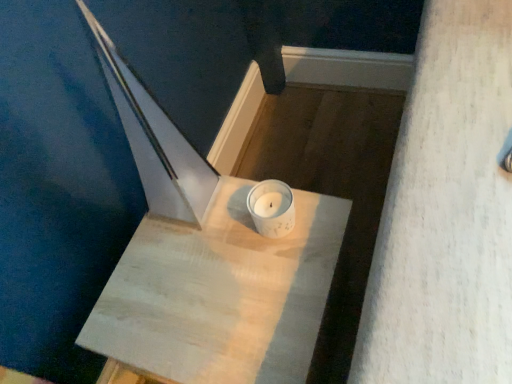
Measure the distance between white marble table at center and camera.

The distance of white marble table at center from camera is 25.28 inches.

What do you see at coordinates (221, 294) in the screenshot? I see `white marble table at center` at bounding box center [221, 294].

You are a GUI agent. You are given a task and a screenshot of the screen. Output one action in this format:
    pyautogui.click(x=<x>, y=<y>)
    Task: Click on the white marble table at center
    
    Given the screenshot: What is the action you would take?
    pyautogui.click(x=221, y=294)

The height and width of the screenshot is (384, 512). Find the location of `white marble table at center`. white marble table at center is located at coordinates pos(221,294).